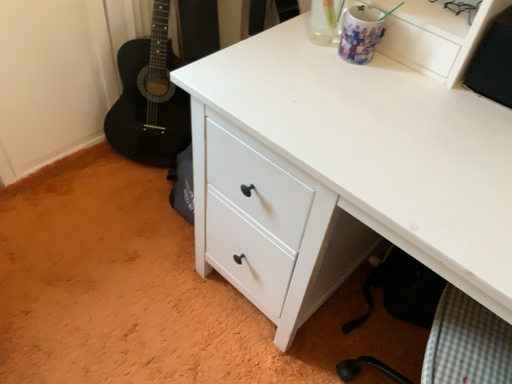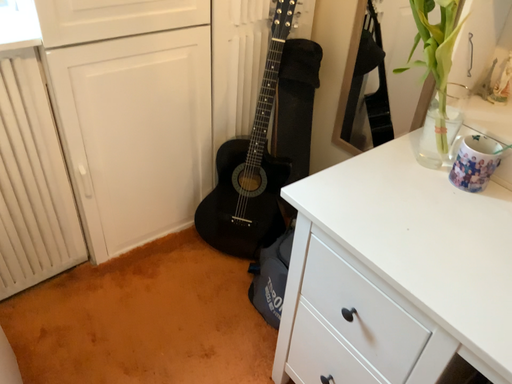
Question: How did the camera likely rotate when shooting the video?

Choices:
 (A) rotated left
 (B) rotated right

Answer: (A)